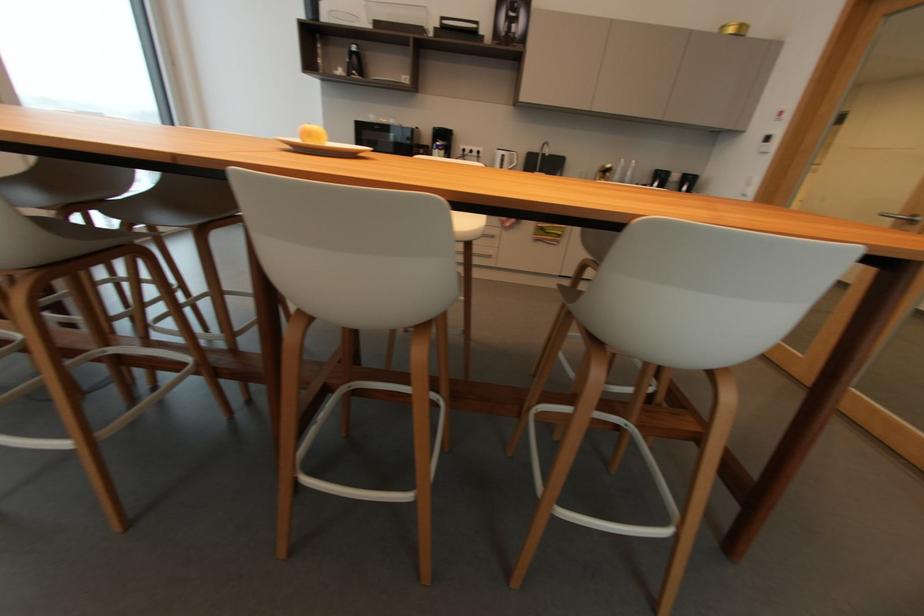
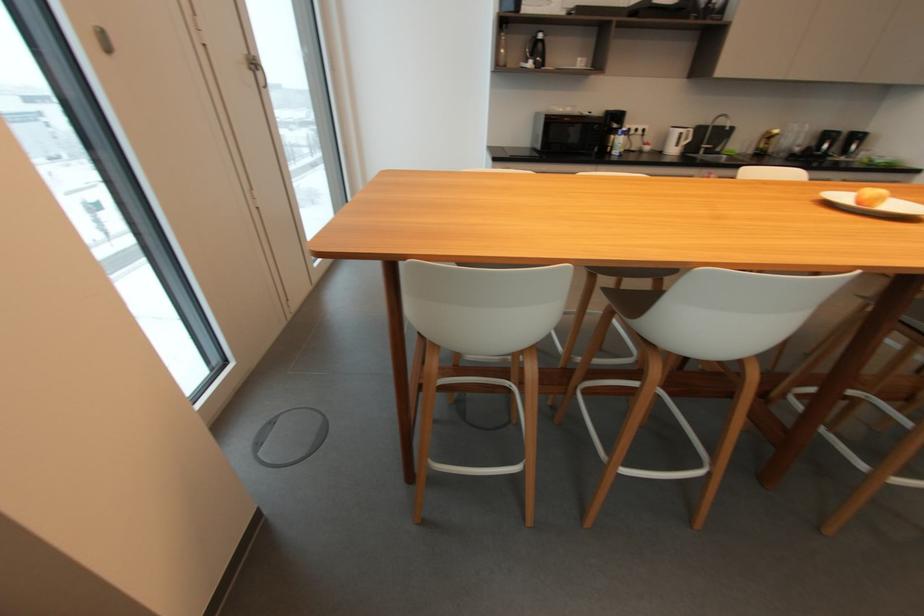
Where in the second image is the point corresponding to the point at 358,49 from the first image?

(544, 36)